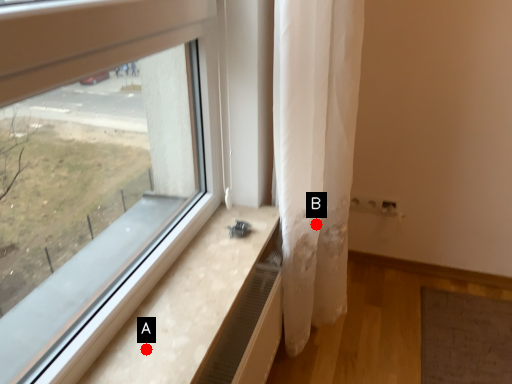
Question: Two points are circled on the image, labeled by A and B beside each circle. Among these points, which one is farthest from the camera?

Choices:
 (A) A is further
 (B) B is further

Answer: (B)